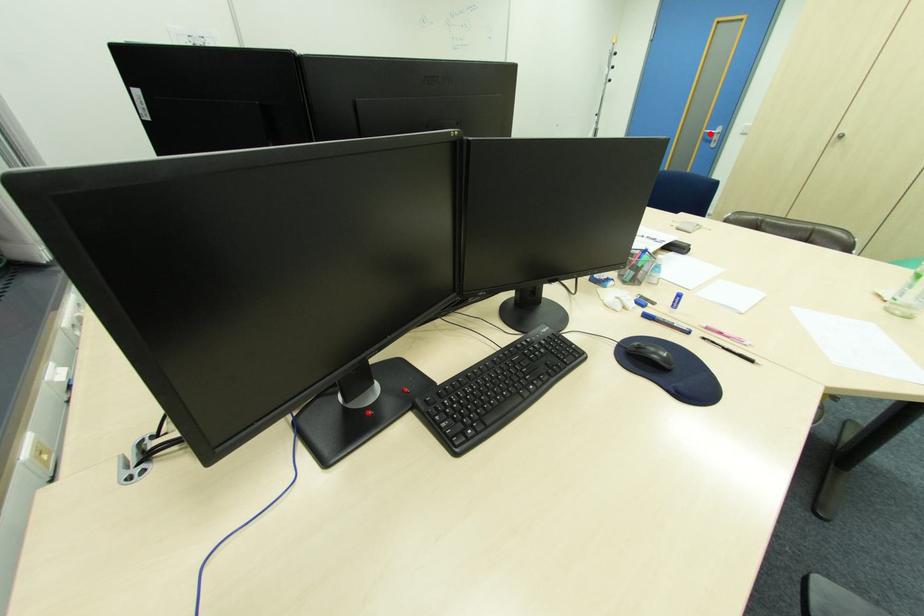
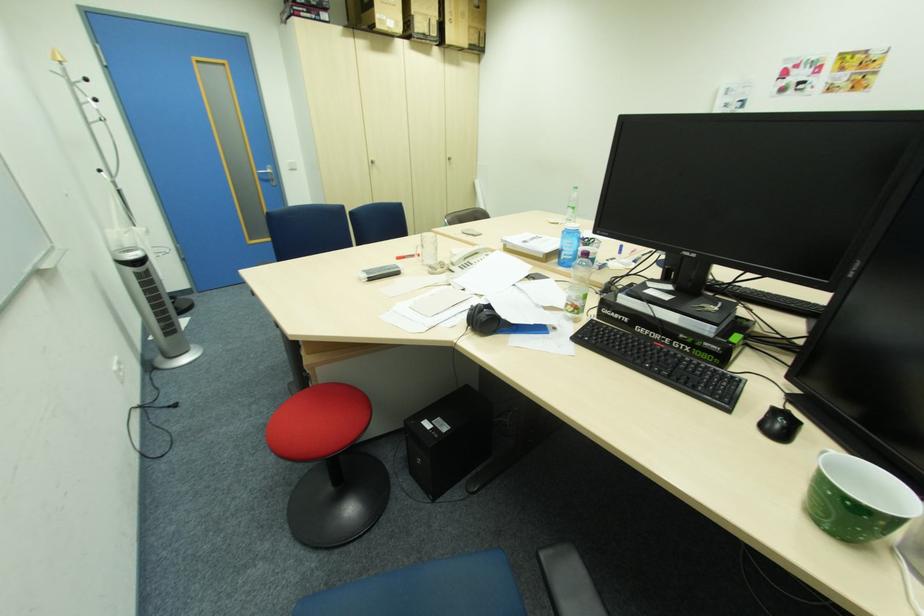
The point at the highlighted location is marked in the first image. Where is the corresponding point in the second image?

(264, 174)